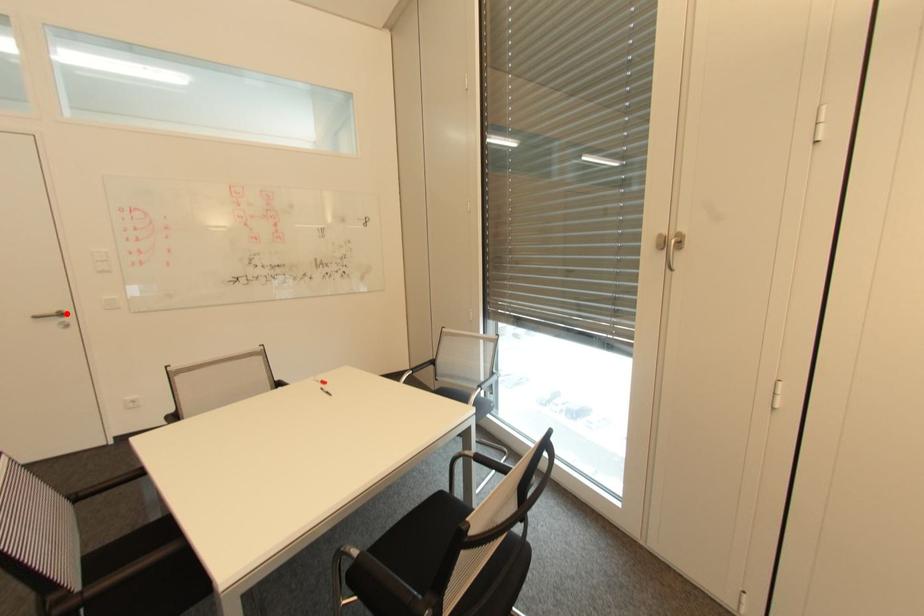
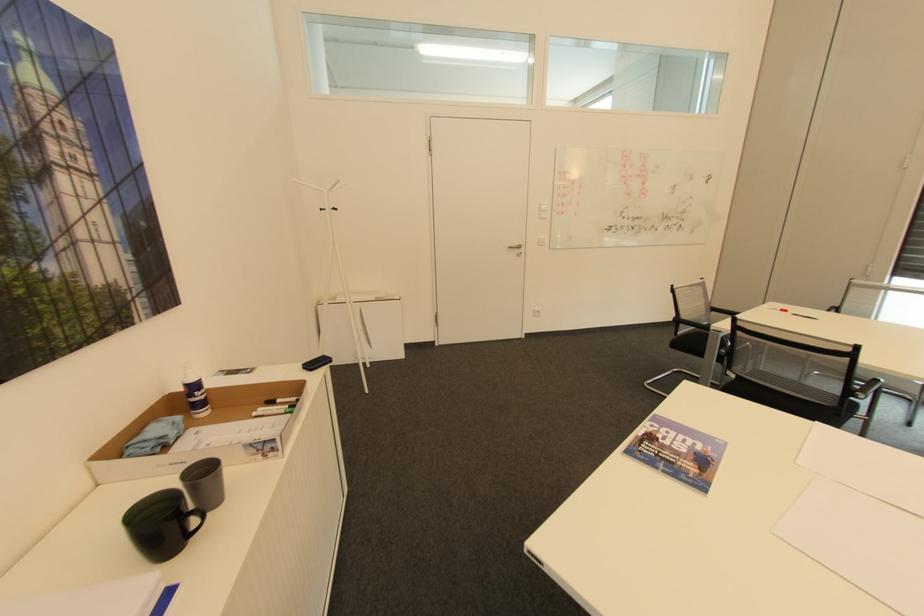
Question: I am providing you with two images of the same scene from different viewpoints. Given a red point in image1, look at the same physical point in image2. Is it:

Choices:
 (A) Closer to the viewpoint
 (B) Farther from the viewpoint

Answer: (A)